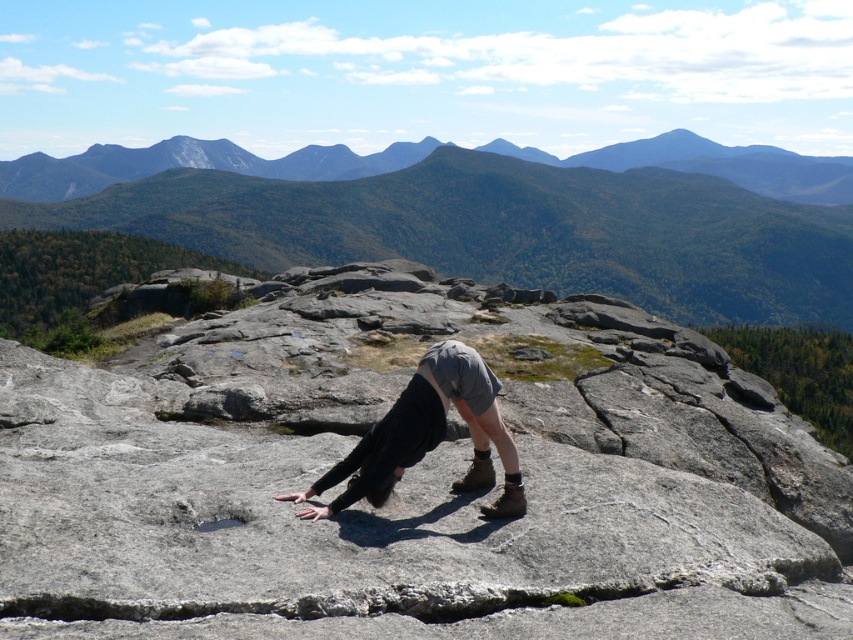
Does green grassy mountain at upper center appear under gray fabric pants at center?

Incorrect, green grassy mountain at upper center is not positioned below gray fabric pants at center.

Is point (682, 140) farther from camera compared to point (434, 417)?

Yes, it is.

Find the location of `green grassy mountain at upper center`. green grassy mountain at upper center is located at coordinates (511, 221).

Is gray rock at center further to camera compared to gray fabric pants at center?

No, it is in front of gray fabric pants at center.

Who is more forward, (143, 595) or (421, 432)?

Point (143, 595) is in front.

The width and height of the screenshot is (853, 640). Identify the location of gray rock at center. (413, 481).

The height and width of the screenshot is (640, 853). I want to click on gray rock at center, so coord(413,481).

Who is lower down, gray rock at center or green grassy mountain at upper center?

Positioned lower is gray rock at center.

Can you confirm if gray rock at center is positioned above green grassy mountain at upper center?

Actually, gray rock at center is below green grassy mountain at upper center.

At what (x,y) coordinates should I click in order to perform the action: click on gray rock at center. Please return your answer as a coordinate pair (x, y). The width and height of the screenshot is (853, 640). Looking at the image, I should click on (413, 481).